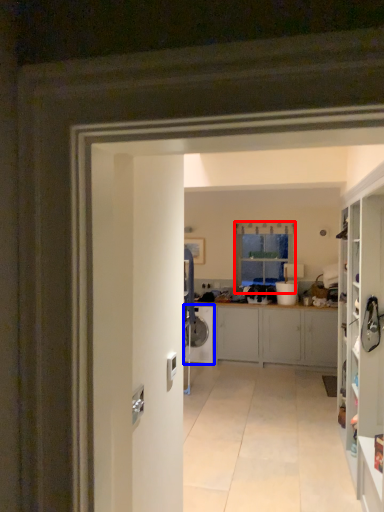
Question: Which of the following is the closest to the observer, window (highlighted by a red box) or washing machine (highlighted by a blue box)?

Choices:
 (A) window
 (B) washing machine

Answer: (B)